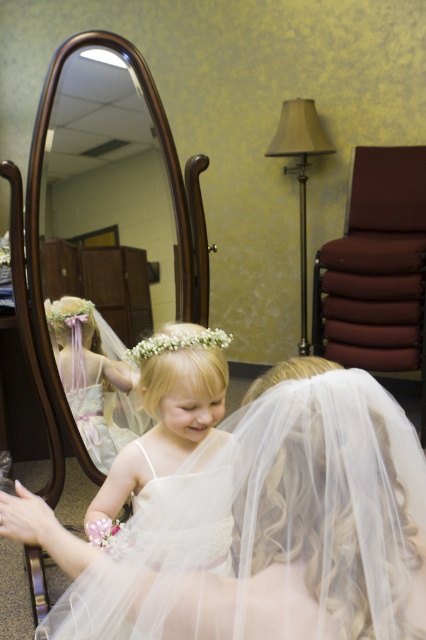
Question: Which point is farther from the camera taking this photo?

Choices:
 (A) (166, 310)
 (B) (134, 625)
 (C) (192, 339)

Answer: (A)

Question: Which of the following is the farthest from the observer?

Choices:
 (A) (97, 362)
 (B) (149, 538)
 (C) (244, 433)

Answer: (A)

Question: Which point appears farthest from the camera in this image?

Choices:
 (A) (83, 328)
 (B) (161, 333)
 (C) (97, 264)

Answer: (C)

Question: Is white tulle veil at lower center above white floral crown at center?

Choices:
 (A) yes
 (B) no

Answer: (B)

Question: Does oval wood mirror at center appear over white tulle dress at lower center?

Choices:
 (A) no
 (B) yes

Answer: (B)

Question: Is pastel pink tulle dress at center to the right of white floral crown at center from the viewer's perspective?

Choices:
 (A) yes
 (B) no

Answer: (B)